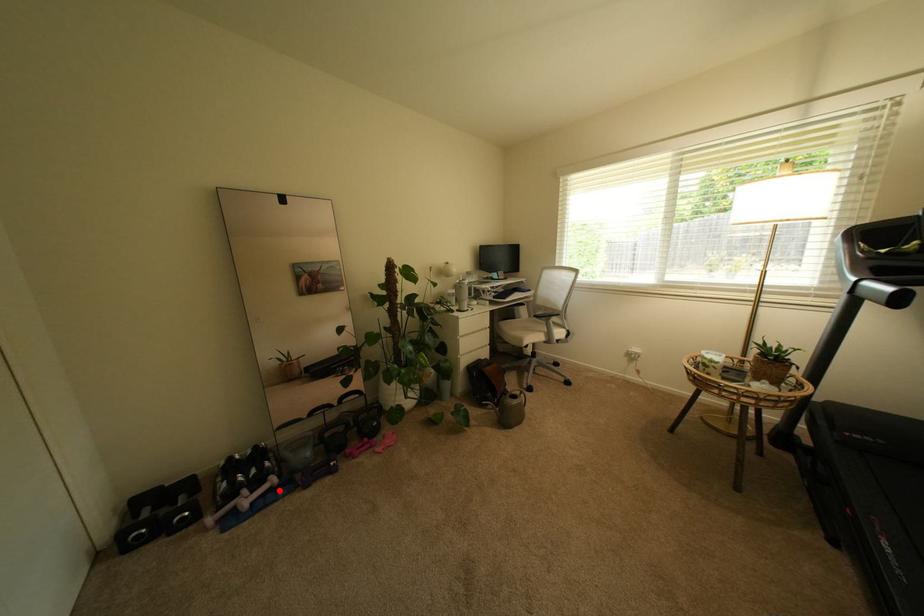
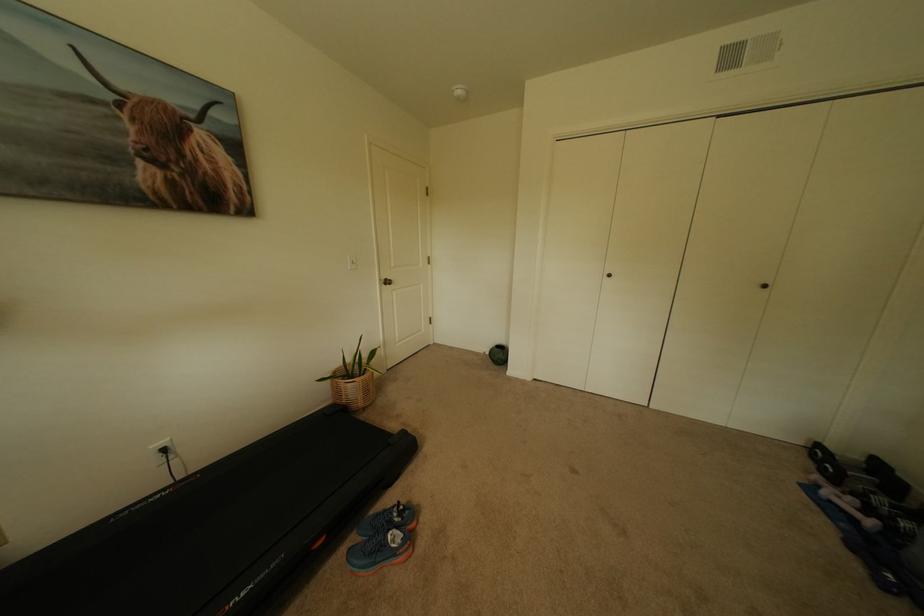
Question: A red point is marked in image1. In image2, is the corresponding 3D point closer to the camera or farther? Reply with the corresponding letter.

Choices:
 (A) The corresponding 3D point is closer.
 (B) The corresponding 3D point is farther.

Answer: (A)